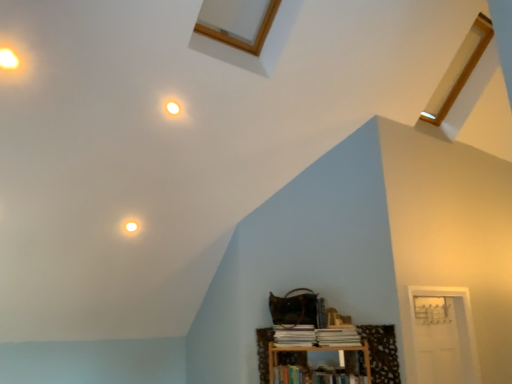
Question: Can you confirm if white paper book at lower center, which is the 1th book from top to bottom, is positioned to the left of white paper book at lower center, the 2th book when ordered from bottom to top?

Choices:
 (A) yes
 (B) no

Answer: (B)

Question: Considering the relative sizes of white paper book at lower center, which is the 1th book from top to bottom, and white paper book at lower center, the 2th book when ordered from bottom to top, in the image provided, is white paper book at lower center, which is the 1th book from top to bottom, thinner than white paper book at lower center, the 2th book when ordered from bottom to top,?

Choices:
 (A) no
 (B) yes

Answer: (B)

Question: Is white paper book at lower center, positioned as the 3th book in bottom-to-top order, taller than white paper book at lower center, marked as the second book in a top-to-bottom arrangement?

Choices:
 (A) yes
 (B) no

Answer: (B)

Question: Is white paper book at lower center, positioned as the 3th book in bottom-to-top order, facing away from white paper book at lower center, marked as the second book in a top-to-bottom arrangement?

Choices:
 (A) no
 (B) yes

Answer: (A)

Question: Is white paper book at lower center, which is the 1th book from top to bottom, bigger than white paper book at lower center, the 2th book when ordered from bottom to top?

Choices:
 (A) yes
 (B) no

Answer: (B)

Question: Are white paper book at lower center, which is the 1th book from top to bottom, and white paper book at lower center, marked as the second book in a top-to-bottom arrangement, far apart?

Choices:
 (A) no
 (B) yes

Answer: (A)

Question: Considering the relative positions of hardcover book at lower center, the first book ordered from the bottom, and white glossy light fixture at upper center, acting as the 1th dot starting from the right, in the image provided, is hardcover book at lower center, the first book ordered from the bottom, behind white glossy light fixture at upper center, acting as the 1th dot starting from the right,?

Choices:
 (A) yes
 (B) no

Answer: (A)

Question: Is hardcover book at lower center, the first book ordered from the bottom, bigger than white glossy light fixture at upper center, placed as the first dot when sorted from bottom to top?

Choices:
 (A) no
 (B) yes

Answer: (B)

Question: Is hardcover book at lower center, the first book ordered from the bottom, outside of white glossy light fixture at upper center, which appears as the first dot when viewed from the back?

Choices:
 (A) yes
 (B) no

Answer: (A)

Question: Can you confirm if hardcover book at lower center, the first book ordered from the bottom, is smaller than white glossy light fixture at upper center, arranged as the 2th dot when viewed from the left?

Choices:
 (A) no
 (B) yes

Answer: (A)

Question: Considering the relative sizes of hardcover book at lower center, the first book ordered from the bottom, and white glossy light fixture at upper center, the second dot viewed from the top, in the image provided, is hardcover book at lower center, the first book ordered from the bottom, thinner than white glossy light fixture at upper center, the second dot viewed from the top,?

Choices:
 (A) yes
 (B) no

Answer: (B)

Question: Could you tell me if hardcover book at lower center, the third book in the top-to-bottom sequence, is turned towards white glossy light fixture at upper center, which appears as the first dot when viewed from the back?

Choices:
 (A) yes
 (B) no

Answer: (B)

Question: Is white paper book at lower center, positioned as the 3th book in bottom-to-top order, directly adjacent to white glossy light fixture at upper left, which ranks as the 1th dot in front-to-back order?

Choices:
 (A) yes
 (B) no

Answer: (B)